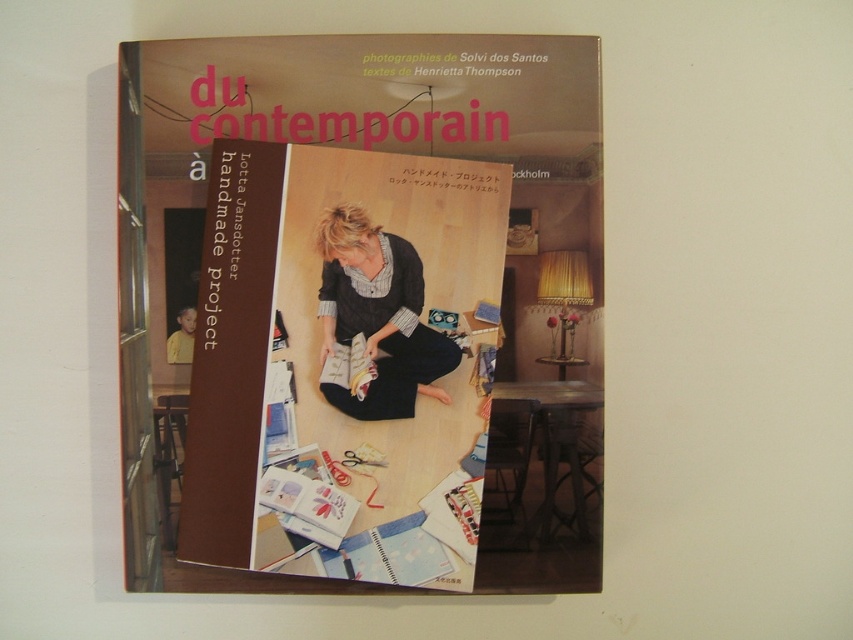
You are holding a matte black book at center and want to place it on a shelf that is 24 inches wide. Will the book fit on the shelf?

The matte black book at center is 25.76 inches in width, so it will not fit on the 24 inch shelf since it is wider than the shelf.

You are designing a display for a bookstore and need to place the matte black book at center and the matte black dress at center on a shelf. The shelf has a width of 2 inches. Can both items fit side by side without overlapping?

The matte black book at center and matte black dress at center are 1.84 inches apart, so they can fit side by side on a 2 inch shelf since the total width required is less than the shelf width.

Consider the image. You are a librarian organizing books on a shelf. You have a matte black book at center and a matte black dress at center in front of you. The shelf has a height limit of 20 cm. Can both items fit vertically on the shelf without exceeding the height limit?

The matte black book at center is larger in size than the matte black dress at center. Since the shelf has a height limit of 20 cm, we need to know the exact heights of both items. However, the description only states the book is larger. Without specific measurements, it is impossible to determine if both will fit within the 20 cm limit.